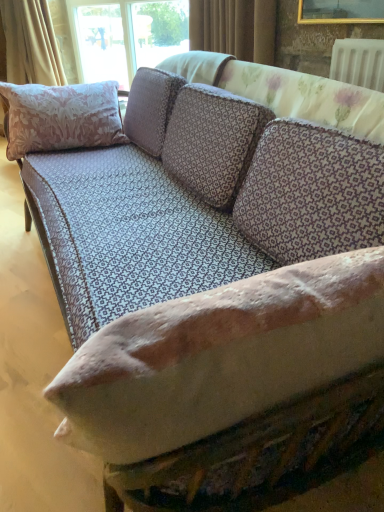
Image resolution: width=384 pixels, height=512 pixels. What do you see at coordinates (61, 117) in the screenshot?
I see `pink floral fabric pillow at left` at bounding box center [61, 117].

Identify the location of beige fabric curtain at upper left, the second curtain in the front-to-back sequence. This screenshot has height=512, width=384. (31, 42).

This screenshot has height=512, width=384. I want to click on pink floral fabric pillow at left, so click(61, 117).

Who is taller, brown textured curtain at upper center, which is the first curtain from front to back, or pink floral fabric pillow at left?

pink floral fabric pillow at left is taller.

Is brown textured curtain at upper center, the second curtain in the back-to-front sequence, not close to pink floral fabric pillow at left?

No, brown textured curtain at upper center, the second curtain in the back-to-front sequence, is in close proximity to pink floral fabric pillow at left.

Is brown textured curtain at upper center, which is counted as the 1th curtain, starting from the right, facing towards pink floral fabric pillow at left?

Yes, brown textured curtain at upper center, which is counted as the 1th curtain, starting from the right, is oriented towards pink floral fabric pillow at left.

From a real-world perspective, between brown textured curtain at upper center, which is counted as the 2th curtain, starting from the left, and pink floral fabric pillow at left, who is vertically higher?

In real-world perspective, brown textured curtain at upper center, which is counted as the 2th curtain, starting from the left, is above.

Is point (19, 33) in front of point (115, 117)?

That is False.

Is the surface of beige fabric curtain at upper left, acting as the second curtain starting from the right, in direct contact with pink floral fabric pillow at left?

No.

Considering the sizes of objects beige fabric curtain at upper left, acting as the second curtain starting from the right, and pink floral fabric pillow at left in the image provided, who is bigger, beige fabric curtain at upper left, acting as the second curtain starting from the right, or pink floral fabric pillow at left?

Bigger between the two is beige fabric curtain at upper left, acting as the second curtain starting from the right.

From a real-world perspective, which object stands above the other?

beige fabric curtain at upper left, positioned as the first curtain in left-to-right order.

Consider the image. From the image's perspective, is pink floral fabric pillow at left above beige fabric curtain at upper left, the second curtain in the front-to-back sequence?

Incorrect, from the image's perspective, pink floral fabric pillow at left is lower than beige fabric curtain at upper left, the second curtain in the front-to-back sequence.

Based on the photo, considering the positions of objects pink floral fabric pillow at left and beige fabric curtain at upper left, positioned as the first curtain in left-to-right order, in the image provided, who is behind, pink floral fabric pillow at left or beige fabric curtain at upper left, positioned as the first curtain in left-to-right order,?

Positioned behind is beige fabric curtain at upper left, positioned as the first curtain in left-to-right order.

How many degrees apart are the facing directions of pink floral fabric pillow at left and beige fabric curtain at upper left, acting as the second curtain starting from the right?

There is a 75.4-degree angle between the facing directions of pink floral fabric pillow at left and beige fabric curtain at upper left, acting as the second curtain starting from the right.

Is beige fabric curtain at upper left, the first curtain in the back-to-front sequence, a part of pink floral fabric pillow at left?

That's incorrect, beige fabric curtain at upper left, the first curtain in the back-to-front sequence, is not inside pink floral fabric pillow at left.

The width and height of the screenshot is (384, 512). Find the location of `pillow that appears in front of the brown textured curtain at upper center, the second curtain in the back-to-front sequence`. pillow that appears in front of the brown textured curtain at upper center, the second curtain in the back-to-front sequence is located at coordinates (61, 117).

Is pink floral fabric pillow at left to the left of brown textured curtain at upper center, which is the first curtain from front to back, from the viewer's perspective?

Indeed, pink floral fabric pillow at left is positioned on the left side of brown textured curtain at upper center, which is the first curtain from front to back.

From a real-world perspective, between pink floral fabric pillow at left and brown textured curtain at upper center, which is the first curtain from front to back, who is vertically higher?

From a 3D spatial view, brown textured curtain at upper center, which is the first curtain from front to back, is above.

Between point (266, 19) and point (46, 26), which one is positioned in front?

Positioned in front is point (266, 19).

Looking at this image, in the image, is brown textured curtain at upper center, the second curtain in the back-to-front sequence, positioned in front of or behind beige fabric curtain at upper left, the first curtain in the back-to-front sequence?

brown textured curtain at upper center, the second curtain in the back-to-front sequence, is positioned closer to the viewer than beige fabric curtain at upper left, the first curtain in the back-to-front sequence.

Is brown textured curtain at upper center, which is the first curtain from front to back, to the right of beige fabric curtain at upper left, acting as the second curtain starting from the right, from the viewer's perspective?

Correct, you'll find brown textured curtain at upper center, which is the first curtain from front to back, to the right of beige fabric curtain at upper left, acting as the second curtain starting from the right.

In the scene shown: From a real-world perspective, between brown textured curtain at upper center, the second curtain in the back-to-front sequence, and beige fabric curtain at upper left, the first curtain in the back-to-front sequence, who is vertically higher?

brown textured curtain at upper center, the second curtain in the back-to-front sequence.

From a real-world perspective, is beige fabric curtain at upper left, the first curtain in the back-to-front sequence, under brown textured curtain at upper center, which is counted as the 1th curtain, starting from the right?

Yes.

Could you measure the distance between beige fabric curtain at upper left, the second curtain in the front-to-back sequence, and brown textured curtain at upper center, the second curtain in the back-to-front sequence?

The distance of beige fabric curtain at upper left, the second curtain in the front-to-back sequence, from brown textured curtain at upper center, the second curtain in the back-to-front sequence, is 1.74 meters.

Is beige fabric curtain at upper left, positioned as the first curtain in left-to-right order, in contact with brown textured curtain at upper center, which is counted as the 1th curtain, starting from the right?

There is a gap between beige fabric curtain at upper left, positioned as the first curtain in left-to-right order, and brown textured curtain at upper center, which is counted as the 1th curtain, starting from the right.

Would you say beige fabric curtain at upper left, the second curtain in the front-to-back sequence, contains brown textured curtain at upper center, which is the first curtain from front to back?

No.

In the image, there is a brown textured curtain at upper center, which is the first curtain from front to back. Where is `pillow below it (from a real-world perspective)`? The height and width of the screenshot is (512, 384). pillow below it (from a real-world perspective) is located at coordinates (61, 117).

Find the location of a particular element. The image size is (384, 512). curtain lying on the left of pink floral fabric pillow at left is located at coordinates (31, 42).

When comparing their distances from brown textured curtain at upper center, the second curtain in the back-to-front sequence, does pink floral fabric pillow at left or beige fabric curtain at upper left, acting as the second curtain starting from the right, seem further?

beige fabric curtain at upper left, acting as the second curtain starting from the right, is positioned further to the anchor brown textured curtain at upper center, the second curtain in the back-to-front sequence.

Estimate the real-world distances between objects in this image. Which object is further from brown textured curtain at upper center, which is the first curtain from front to back, beige fabric curtain at upper left, the second curtain in the front-to-back sequence, or pink floral fabric pillow at left?

beige fabric curtain at upper left, the second curtain in the front-to-back sequence.

Considering their positions, is brown textured curtain at upper center, the second curtain in the back-to-front sequence, positioned closer to beige fabric curtain at upper left, acting as the second curtain starting from the right, than pink floral fabric pillow at left?

pink floral fabric pillow at left is positioned closer to the anchor beige fabric curtain at upper left, acting as the second curtain starting from the right.

When comparing their distances from beige fabric curtain at upper left, acting as the second curtain starting from the right, does pink floral fabric pillow at left or brown textured curtain at upper center, which is the first curtain from front to back, seem further?

brown textured curtain at upper center, which is the first curtain from front to back, lies further to beige fabric curtain at upper left, acting as the second curtain starting from the right, than the other object.

Estimate the real-world distances between objects in this image. Which object is further from pink floral fabric pillow at left, brown textured curtain at upper center, the second curtain in the back-to-front sequence, or beige fabric curtain at upper left, positioned as the first curtain in left-to-right order?

beige fabric curtain at upper left, positioned as the first curtain in left-to-right order.

Estimate the real-world distances between objects in this image. Which object is further from pink floral fabric pillow at left, beige fabric curtain at upper left, the first curtain in the back-to-front sequence, or brown textured curtain at upper center, which is counted as the 2th curtain, starting from the left?

The object further to pink floral fabric pillow at left is beige fabric curtain at upper left, the first curtain in the back-to-front sequence.

You are a GUI agent. You are given a task and a screenshot of the screen. Output one action in this format:
    pyautogui.click(x=<x>, y=<y>)
    Task: Click on the pillow situated between beige fabric curtain at upper left, positioned as the first curtain in left-to-right order, and brown textured curtain at upper center, which is counted as the 2th curtain, starting from the left, from left to right
    
    Given the screenshot: What is the action you would take?
    pyautogui.click(x=61, y=117)